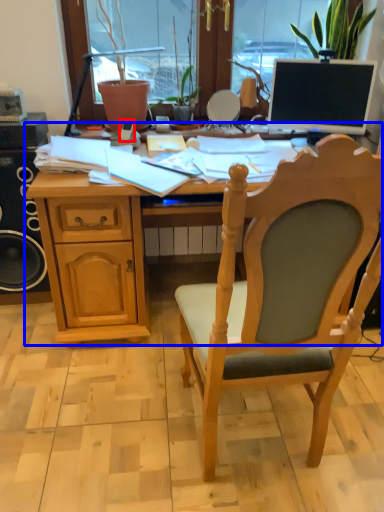
Question: Which point is further to the camera, mobile phone (highlighted by a red box) or desk (highlighted by a blue box)?

Choices:
 (A) mobile phone
 (B) desk

Answer: (A)